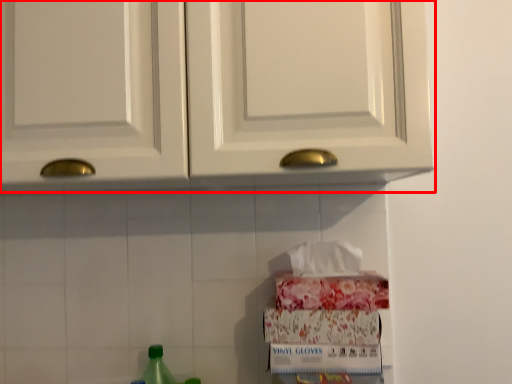
Question: Observing the image, what is the correct spatial positioning of cabinetry (annotated by the red box) in reference to bottle?

Choices:
 (A) left
 (B) right

Answer: (B)